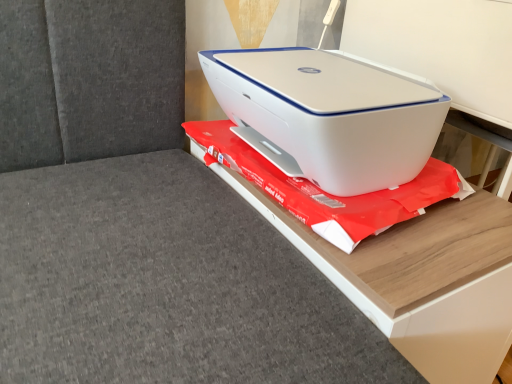
Question: Is point (372, 316) closer or farther from the camera than point (438, 160)?

Choices:
 (A) closer
 (B) farther

Answer: (A)

Question: From a real-world perspective, is white plastic printer at upper center positioned above or below white plastic printer at center?

Choices:
 (A) below
 (B) above

Answer: (A)

Question: Which is nearer to the white plastic printer at upper right?

Choices:
 (A) white plastic printer at center
 (B) white plastic printer at upper center

Answer: (A)

Question: Which is farther from the white plastic printer at upper center?

Choices:
 (A) white plastic printer at center
 (B) white plastic printer at upper right

Answer: (B)